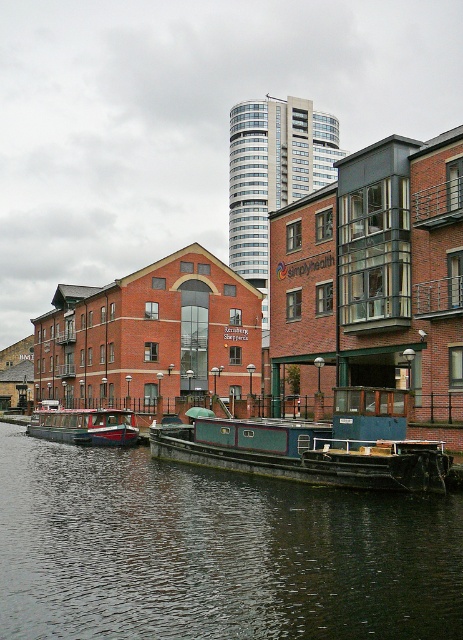
You are a delivery drone that needs to fly over the dark green water at center and the red polished wood boat at center. Based on the scene, which one do you think has a larger width?

The dark green water at center is wider than the red polished wood boat at center according to the description.

You are a boat operator who needs to navigate a new boat through the waterfront. You see the dark green water at center and the teal matte barge at center. Which one is wider?

The dark green water at center is wider than the teal matte barge at center according to the description.